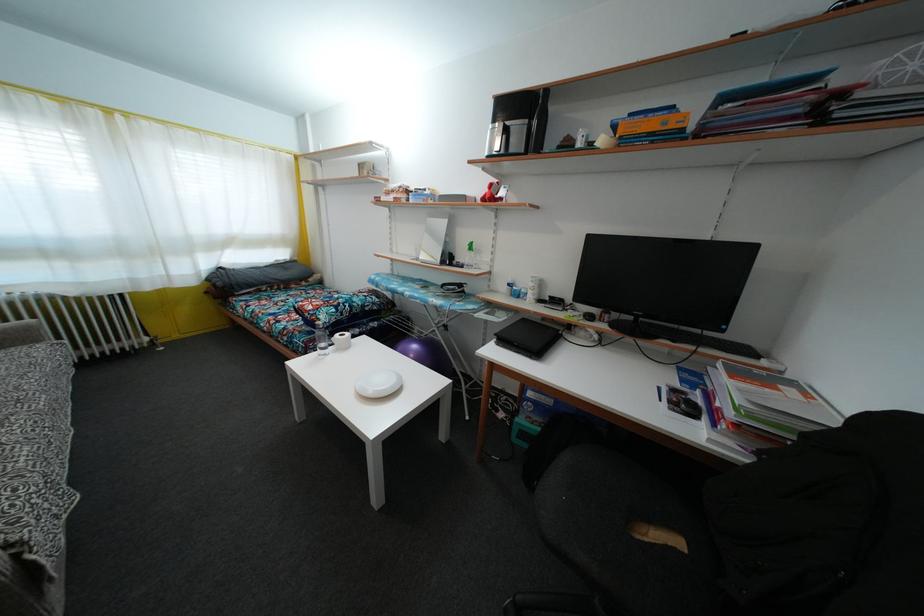
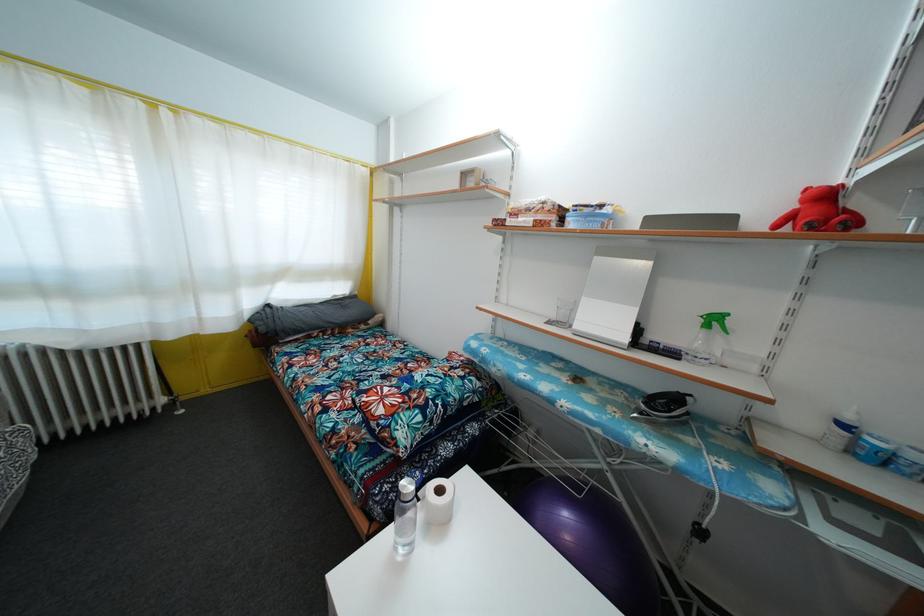
Where in the second image is the point corresponding to [513,291] from the first image?

(848, 432)